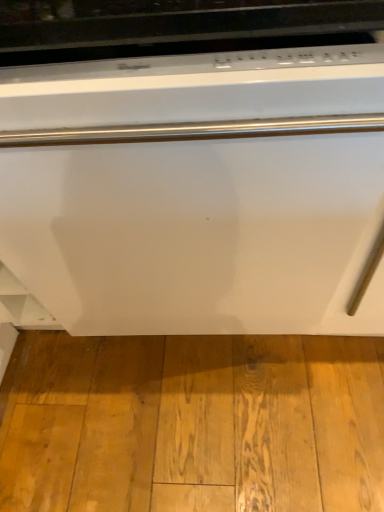
Question: From the image's perspective, is light brown wood flooring at lower center beneath white glossy dishwasher at center?

Choices:
 (A) yes
 (B) no

Answer: (A)

Question: Can you confirm if light brown wood flooring at lower center is bigger than white glossy dishwasher at center?

Choices:
 (A) yes
 (B) no

Answer: (B)

Question: Is light brown wood flooring at lower center turned away from white glossy dishwasher at center?

Choices:
 (A) no
 (B) yes

Answer: (A)

Question: Is light brown wood flooring at lower center further to the viewer compared to white glossy dishwasher at center?

Choices:
 (A) yes
 (B) no

Answer: (A)

Question: Considering the relative positions of light brown wood flooring at lower center and white glossy dishwasher at center in the image provided, is light brown wood flooring at lower center to the left of white glossy dishwasher at center from the viewer's perspective?

Choices:
 (A) yes
 (B) no

Answer: (B)

Question: Can you confirm if light brown wood flooring at lower center is shorter than white glossy dishwasher at center?

Choices:
 (A) yes
 (B) no

Answer: (A)

Question: From a real-world perspective, is white glossy dishwasher at center physically below light brown wood flooring at lower center?

Choices:
 (A) no
 (B) yes

Answer: (A)

Question: From the image's perspective, is white glossy dishwasher at center above light brown wood flooring at lower center?

Choices:
 (A) no
 (B) yes

Answer: (B)

Question: Is white glossy dishwasher at center thinner than light brown wood flooring at lower center?

Choices:
 (A) yes
 (B) no

Answer: (B)

Question: Can you confirm if white glossy dishwasher at center is wider than light brown wood flooring at lower center?

Choices:
 (A) no
 (B) yes

Answer: (B)

Question: Is white glossy dishwasher at center smaller than light brown wood flooring at lower center?

Choices:
 (A) no
 (B) yes

Answer: (A)

Question: Does white glossy dishwasher at center come behind light brown wood flooring at lower center?

Choices:
 (A) no
 (B) yes

Answer: (A)

Question: From a real-world perspective, is light brown wood flooring at lower center positioned above or below white glossy dishwasher at center?

Choices:
 (A) above
 (B) below

Answer: (B)